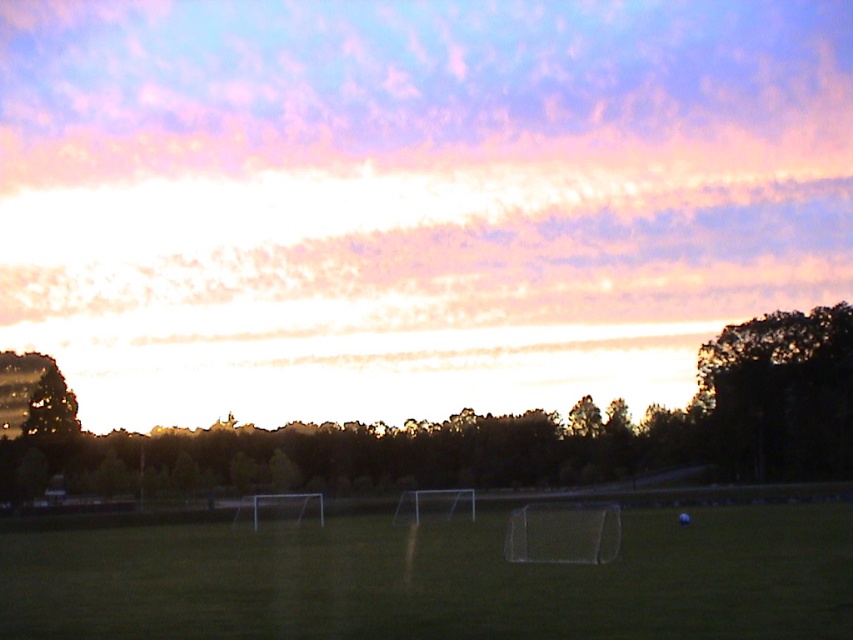
Question: Which object appears closest to the camera in this image?

Choices:
 (A) green grass at center
 (B) dark green leafy tree at right

Answer: (A)

Question: Does green grass at center have a greater width compared to dark green leafy tree at right?

Choices:
 (A) no
 (B) yes

Answer: (B)

Question: Among these objects, which one is nearest to the camera?

Choices:
 (A) dark green leafy tree at right
 (B) dark green leafy tree at center

Answer: (B)

Question: Is the position of dark green leafy tree at center less distant than that of dark green leafy tree at right?

Choices:
 (A) yes
 (B) no

Answer: (A)

Question: Observing the image, what is the correct spatial positioning of dark green leafy tree at center in reference to dark green leafy tree at right?

Choices:
 (A) right
 (B) left

Answer: (B)

Question: Estimate the real-world distances between objects in this image. Which object is closer to the green grass at center?

Choices:
 (A) dark green leafy tree at right
 (B) dark green leafy tree at center

Answer: (A)